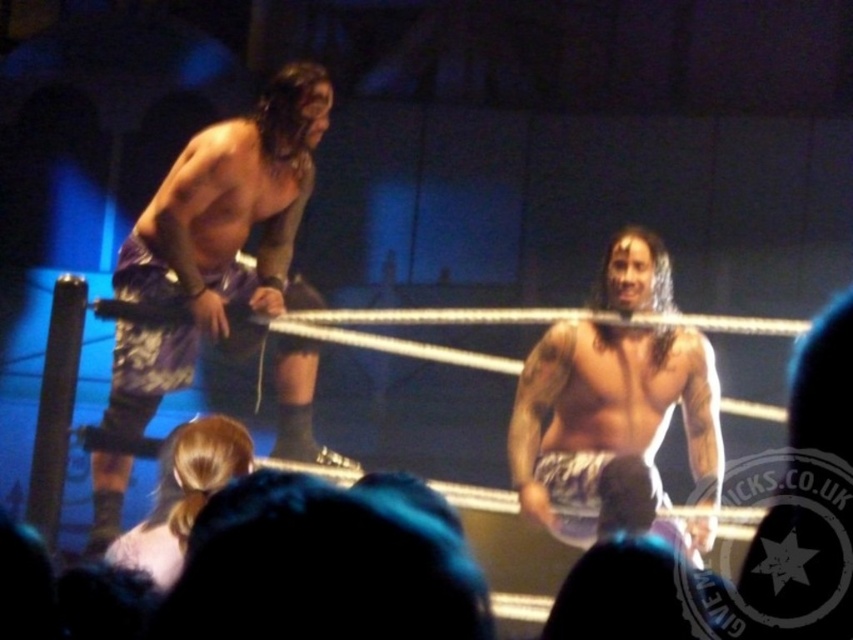
Question: Does shiny metallic shorts at center appear over tattooed skin at center?

Choices:
 (A) yes
 (B) no

Answer: (A)

Question: Estimate the real-world distances between objects in this image. Which object is closer to the purple fabric shorts at left?

Choices:
 (A) tattooed skin at center
 (B) shiny metallic shorts at center

Answer: (A)

Question: Which is nearer to the tattooed skin at center?

Choices:
 (A) musclesmoothtorso at left
 (B) shiny metallic shorts at center
 (C) purple fabric shorts at left

Answer: (B)

Question: Is purple fabric shorts at left smaller than shiny metallic shorts at center?

Choices:
 (A) yes
 (B) no

Answer: (B)

Question: Which of these objects is positioned closest to the tattooed skin at center?

Choices:
 (A) shiny metallic shorts at center
 (B) musclesmoothtorso at left
 (C) purple fabric shorts at left

Answer: (A)

Question: Does shiny metallic shorts at center appear on the left side of musclesmoothtorso at left?

Choices:
 (A) no
 (B) yes

Answer: (A)